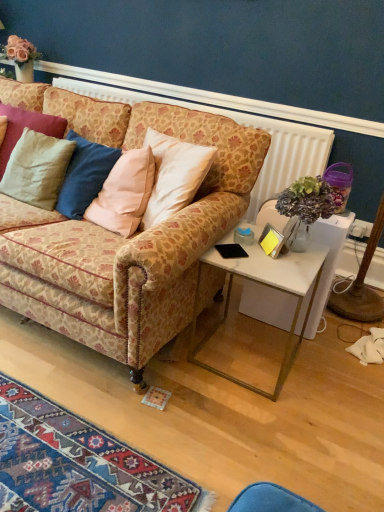
Locate an element on the screen. free space in front of white marble side table at right is located at coordinates (249, 424).